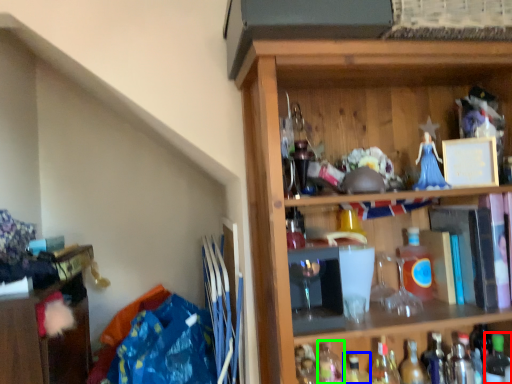
Question: Estimate the real-world distances between objects in this image. Which object is farther from bottle (highlighted by a red box), bottle (highlighted by a blue box) or bottle (highlighted by a green box)?

Choices:
 (A) bottle
 (B) bottle

Answer: (B)